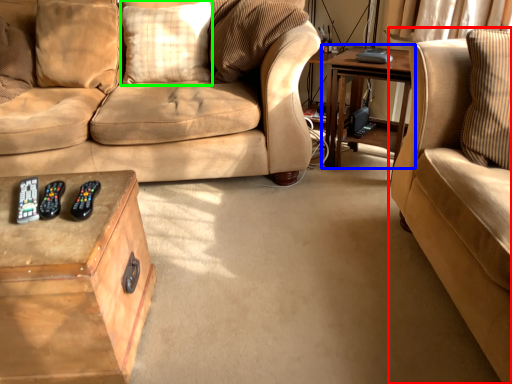
Question: Which is nearer to the studio couch (highlighted by a red box)? table (highlighted by a blue box) or pillow (highlighted by a green box).

Choices:
 (A) table
 (B) pillow

Answer: (A)